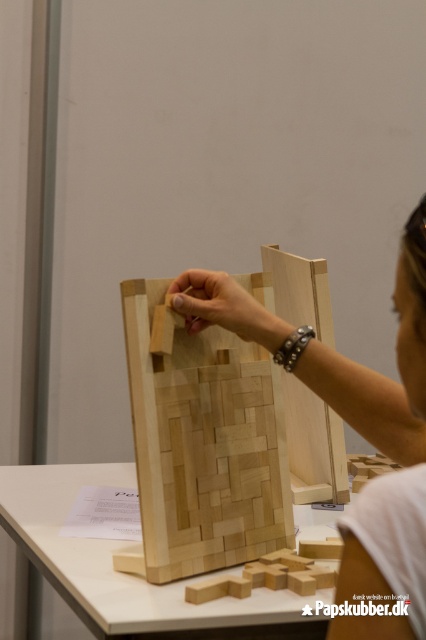
Question: Among these points, which one is farthest from the camera?

Choices:
 (A) (420, 250)
 (B) (256, 275)

Answer: (B)

Question: Where is natural wood puzzle piece at center located in relation to natural wood hand at center in the image?

Choices:
 (A) right
 (B) left

Answer: (B)

Question: Considering the relative positions of natural wood puzzle piece at center and natural wood hand at center in the image provided, where is natural wood puzzle piece at center located with respect to natural wood hand at center?

Choices:
 (A) left
 (B) right

Answer: (A)

Question: Which of the following is the farthest from the observer?

Choices:
 (A) natural wood hand at center
 (B) natural wood puzzle piece at center

Answer: (B)

Question: Is natural wood puzzle piece at center below natural wood hand at center?

Choices:
 (A) yes
 (B) no

Answer: (A)

Question: Which object appears farthest from the camera in this image?

Choices:
 (A) natural wood hand at center
 (B) natural wood puzzle piece at center

Answer: (B)